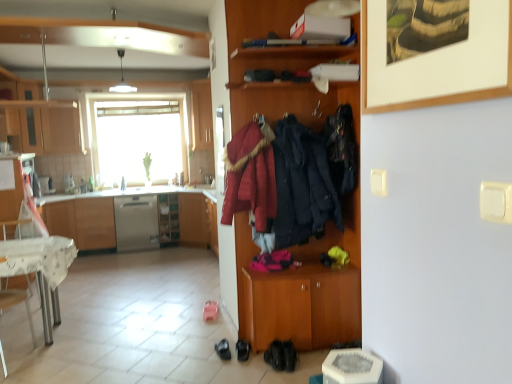
Question: Is velvet-like red coat at center, the third clothing viewed from the right, positioned far away from wooden cabinet at center?

Choices:
 (A) yes
 (B) no

Answer: (A)

Question: Does velvet-like red coat at center, the third clothing viewed from the right, appear on the right side of wooden cabinet at center?

Choices:
 (A) no
 (B) yes

Answer: (B)

Question: Is wooden cabinet at center at the back of velvet-like red coat at center, placed as the 1th clothing when sorted from left to right?

Choices:
 (A) yes
 (B) no

Answer: (A)

Question: Considering the relative positions of velvet-like red coat at center, the third clothing viewed from the right, and wooden cabinet at center in the image provided, is velvet-like red coat at center, the third clothing viewed from the right, to the left of wooden cabinet at center from the viewer's perspective?

Choices:
 (A) no
 (B) yes

Answer: (A)

Question: From a real-world perspective, is velvet-like red coat at center, the third clothing viewed from the right, physically below wooden cabinet at center?

Choices:
 (A) no
 (B) yes

Answer: (A)

Question: Does velvet-like red coat at center, the third clothing viewed from the right, have a larger size compared to wooden cabinet at center?

Choices:
 (A) yes
 (B) no

Answer: (B)

Question: Does velvet-like dark blue coat at center, which is counted as the second clothing, starting from the right, touch dark blue fabric jacket at center, marked as the third clothing in a left-to-right arrangement?

Choices:
 (A) no
 (B) yes

Answer: (A)

Question: From the image's perspective, is velvet-like dark blue coat at center, which ranks as the 2th clothing in left-to-right order, above dark blue fabric jacket at center, marked as the third clothing in a left-to-right arrangement?

Choices:
 (A) no
 (B) yes

Answer: (A)

Question: Considering the relative positions of velvet-like dark blue coat at center, which ranks as the 2th clothing in left-to-right order, and dark blue fabric jacket at center, marked as the third clothing in a left-to-right arrangement, in the image provided, is velvet-like dark blue coat at center, which ranks as the 2th clothing in left-to-right order, in front of dark blue fabric jacket at center, marked as the third clothing in a left-to-right arrangement,?

Choices:
 (A) no
 (B) yes

Answer: (B)

Question: Is velvet-like dark blue coat at center, which is counted as the second clothing, starting from the right, not within dark blue fabric jacket at center, arranged as the 1th clothing when viewed from the right?

Choices:
 (A) no
 (B) yes

Answer: (B)

Question: Does velvet-like dark blue coat at center, which is counted as the second clothing, starting from the right, come behind dark blue fabric jacket at center, marked as the third clothing in a left-to-right arrangement?

Choices:
 (A) no
 (B) yes

Answer: (A)

Question: Does velvet-like dark blue coat at center, which is counted as the second clothing, starting from the right, have a greater width compared to dark blue fabric jacket at center, arranged as the 1th clothing when viewed from the right?

Choices:
 (A) no
 (B) yes

Answer: (B)

Question: Does satin silver dishwasher at center have a lesser height compared to wooden coat rack at center, which is the 4th cabinetry in back-to-front order?

Choices:
 (A) no
 (B) yes

Answer: (B)